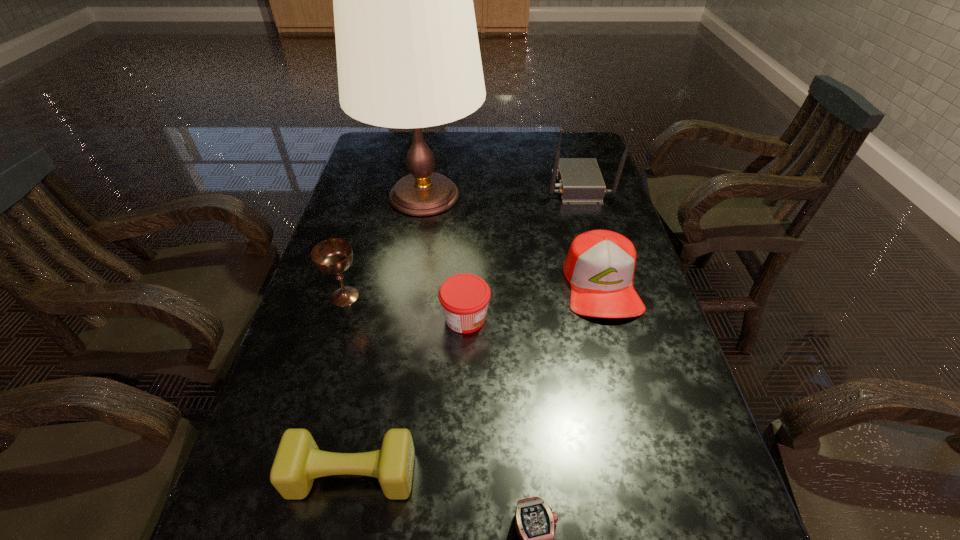
What are the coordinates of `blank area located 0.340m on the front of the chalice` in the screenshot? It's located at (300, 449).

I want to click on free region located on the front-facing side of the baseball cap, so click(649, 461).

The height and width of the screenshot is (540, 960). I want to click on vacant region located 0.060m on the label side of the jam, so click(516, 318).

This screenshot has width=960, height=540. Identify the location of free space located on the back of the dumbbell. (380, 337).

Image resolution: width=960 pixels, height=540 pixels. Find the location of `object positioned at the far edge`. object positioned at the far edge is located at coordinates (408, 56).

Find the location of a particular element. This screenshot has height=540, width=960. lamp that is at the left edge is located at coordinates (408, 56).

Where is `chalice at the left edge`? The image size is (960, 540). chalice at the left edge is located at coordinates (334, 256).

The image size is (960, 540). What are the coordinates of `dumbbell positioned at the left edge` in the screenshot? It's located at (298, 461).

Find the location of `router situated at the right edge`. router situated at the right edge is located at coordinates (580, 181).

What are the coordinates of `baseball cap located at the right edge` in the screenshot? It's located at (600, 264).